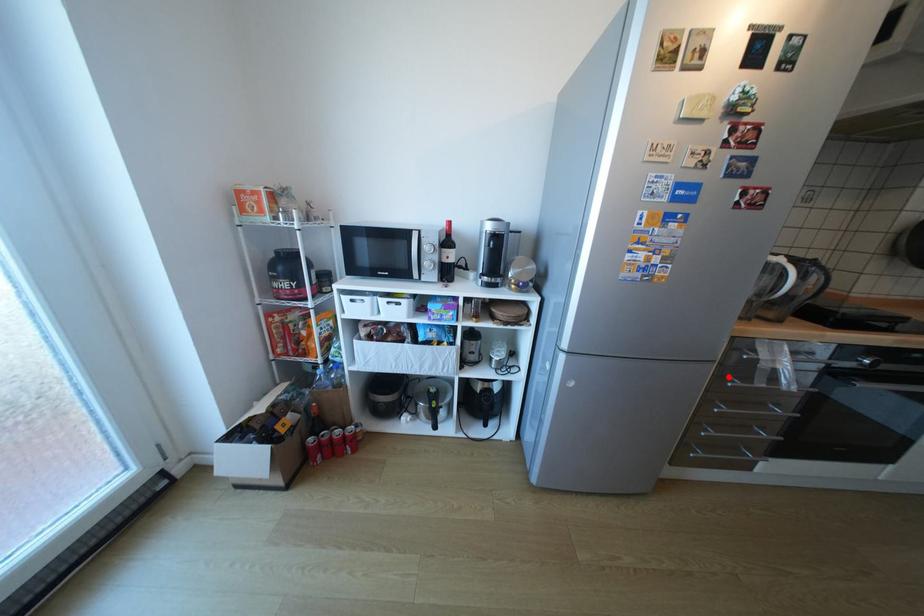
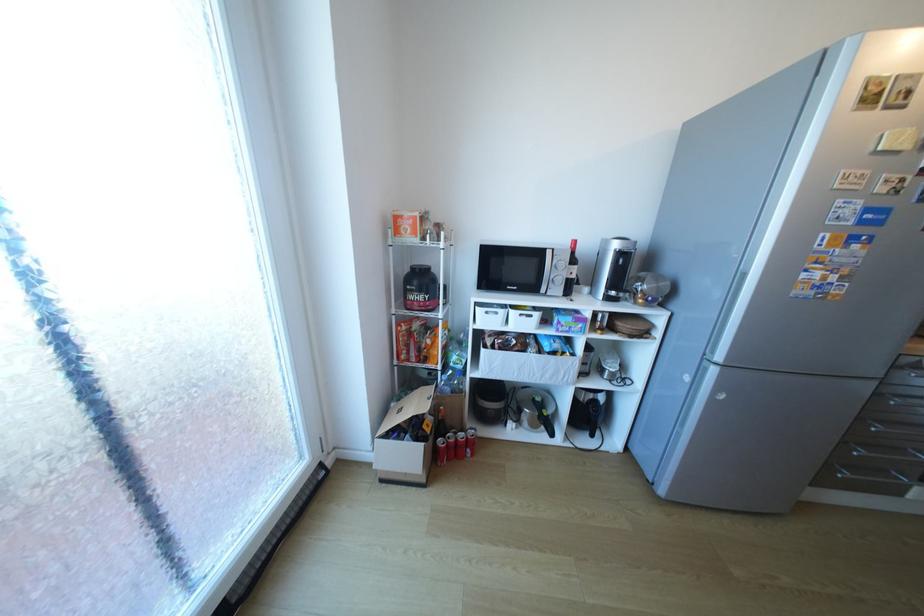
Question: I am providing you with two images of the same scene from different viewpoints. In image1, a red point is highlighted. Considering the same 3D point in image2, which of the following is correct?

Choices:
 (A) It is closer
 (B) It is farther

Answer: (A)